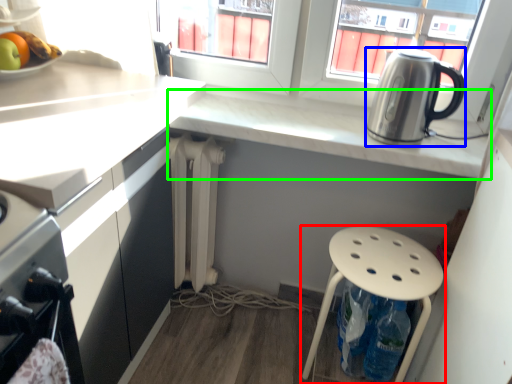
Question: Based on their relative distances, which object is farther from stool (highlighted by a red box)? Choose from kitchen appliance (highlighted by a blue box) and countertop (highlighted by a green box).

Choices:
 (A) kitchen appliance
 (B) countertop

Answer: (A)